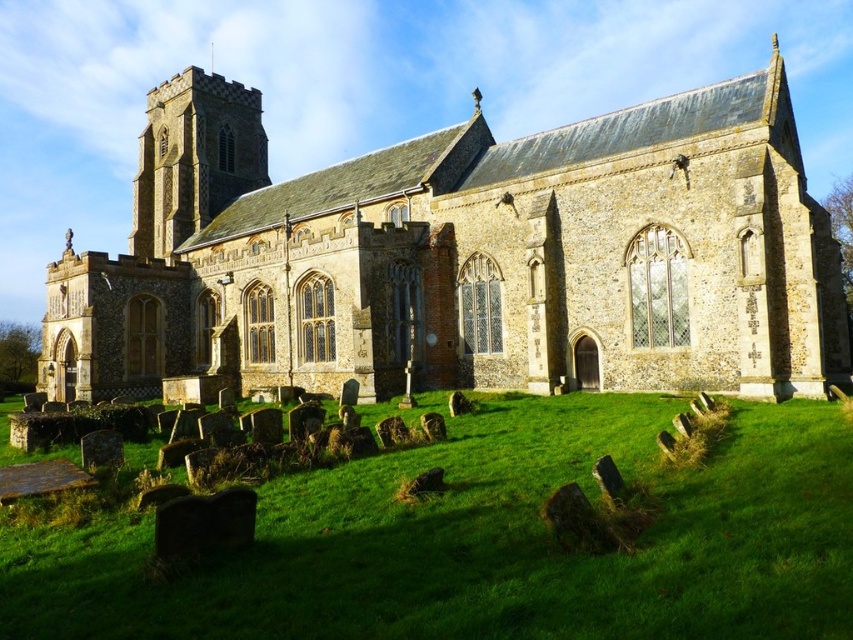
Question: Which point is farther to the camera?

Choices:
 (A) (70, 536)
 (B) (662, 243)

Answer: (B)

Question: Is brown stone church at center to the left of green grass at lower center from the viewer's perspective?

Choices:
 (A) yes
 (B) no

Answer: (A)

Question: Is brown stone church at center smaller than green grass at lower center?

Choices:
 (A) yes
 (B) no

Answer: (B)

Question: Observing the image, what is the correct spatial positioning of brown stone church at center in reference to green grass at lower center?

Choices:
 (A) left
 (B) right

Answer: (A)

Question: Among these objects, which one is farthest from the camera?

Choices:
 (A) green grass at lower center
 (B) brown stone church at center

Answer: (B)